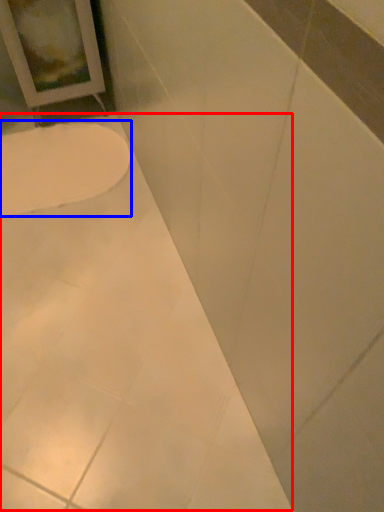
Question: Which point is further to the camera, bath (highlighted by a red box) or toilet (highlighted by a blue box)?

Choices:
 (A) bath
 (B) toilet

Answer: (B)